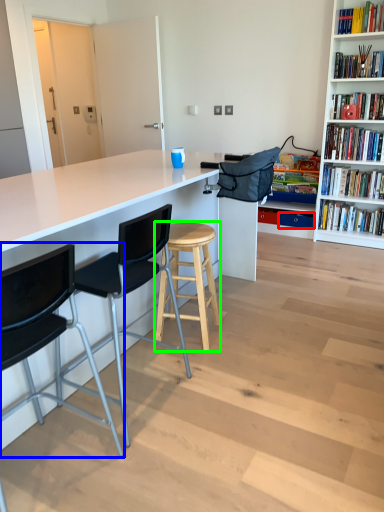
Question: Which is nearer to the drawer (highlighted by a red box)? chair (highlighted by a blue box) or stool (highlighted by a green box).

Choices:
 (A) chair
 (B) stool

Answer: (B)